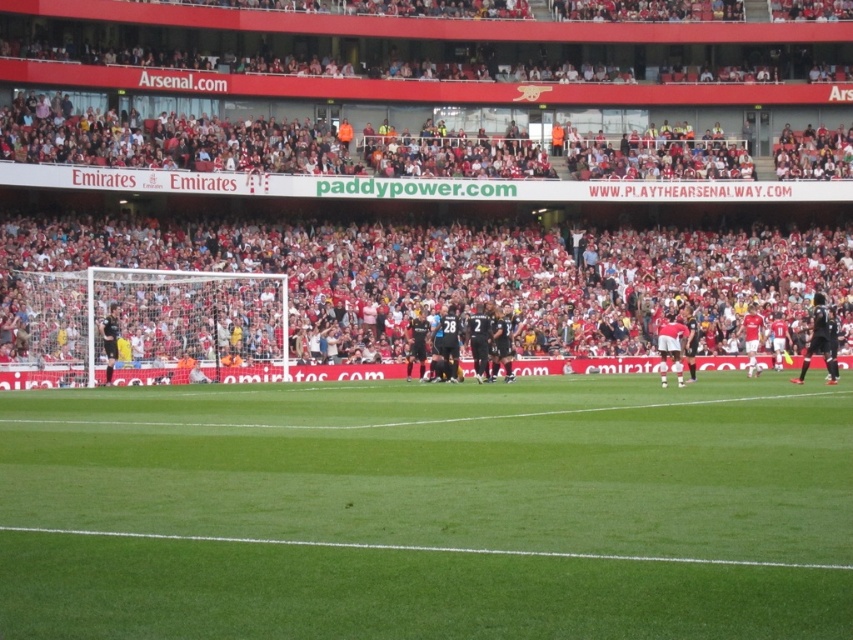
Question: Among these objects, which one is farthest from the camera?

Choices:
 (A) white jersey at center
 (B) green grass at center

Answer: (A)

Question: Which of the following is the farthest from the observer?

Choices:
 (A) (741, 324)
 (B) (157, 449)

Answer: (A)

Question: From the image, what is the correct spatial relationship of black matte jersey at right in relation to red jersey at center?

Choices:
 (A) left
 (B) right

Answer: (B)

Question: Is green grass at center bigger than black matte jersey at right?

Choices:
 (A) no
 (B) yes

Answer: (A)

Question: Which object is the closest to the green grass at center?

Choices:
 (A) white jersey at center
 (B) black matte jersey at right

Answer: (A)

Question: Can you confirm if green grass at center is positioned to the left of red jersey at center?

Choices:
 (A) yes
 (B) no

Answer: (A)